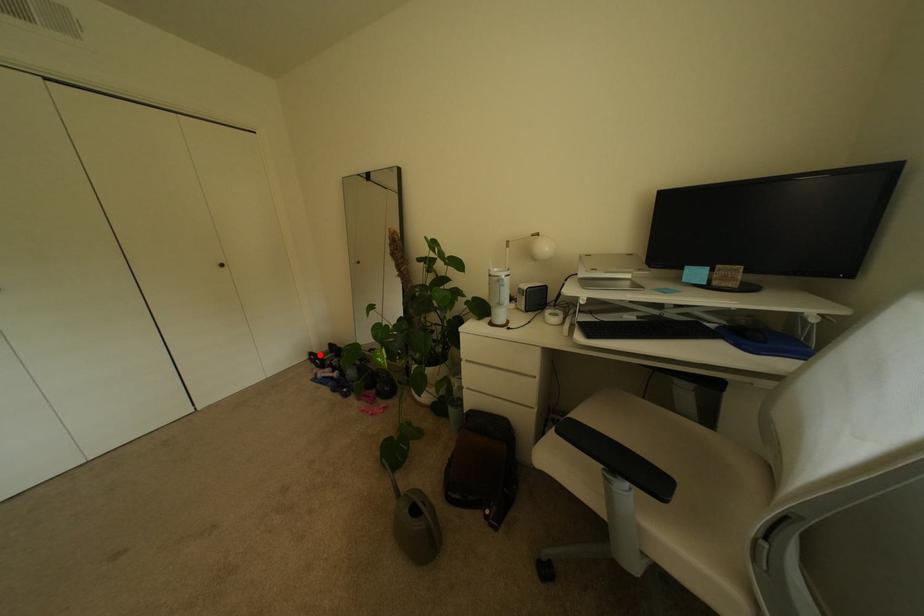
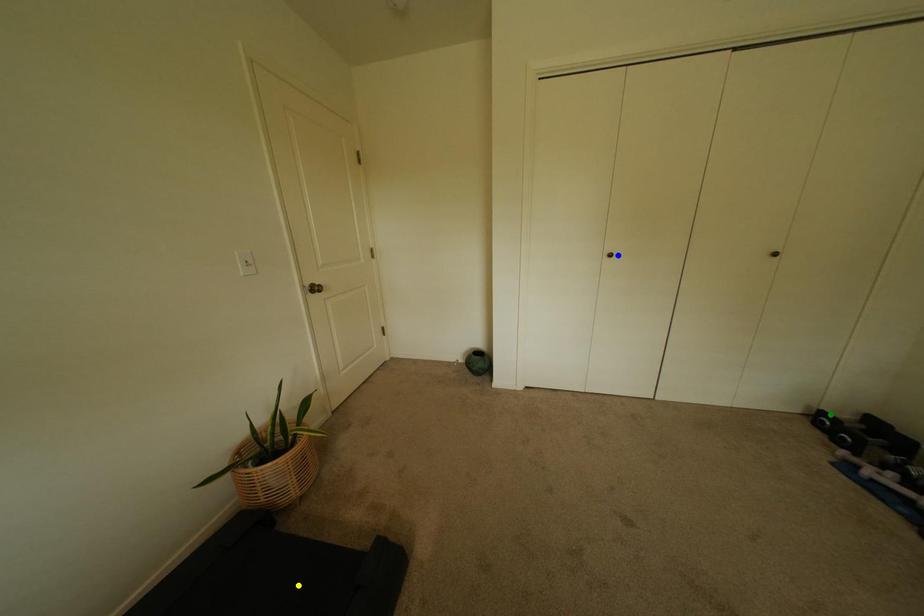
Question: I am providing you with two images of the same scene from different viewpoints. A red point is marked on the first image. You are given multiple points on the second image. In image 2, which mark is for the same physical point as the one in image 1?

Choices:
 (A) yellow point
 (B) blue point
 (C) green point

Answer: (C)